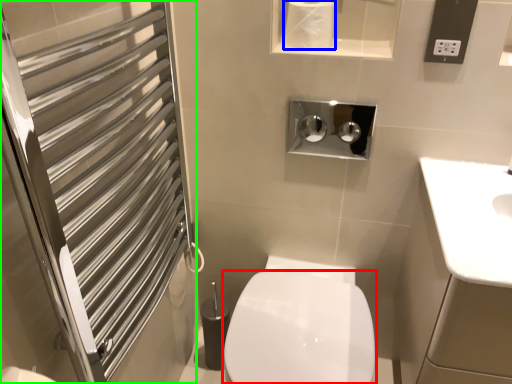
Question: Which object is positioned farthest from bidet (highlighted by a red box)? Select from toilet paper (highlighted by a blue box) and screen door (highlighted by a green box).

Choices:
 (A) toilet paper
 (B) screen door

Answer: (A)